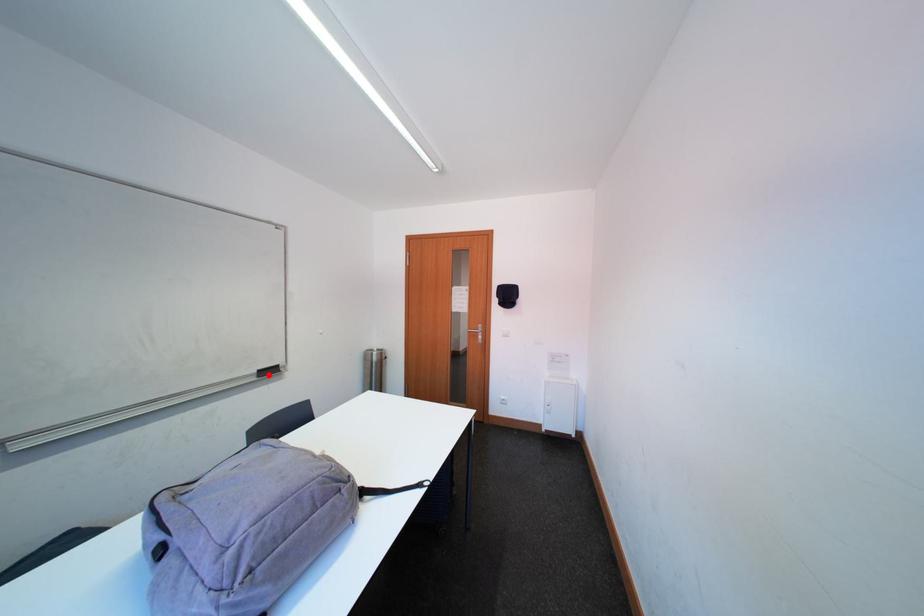
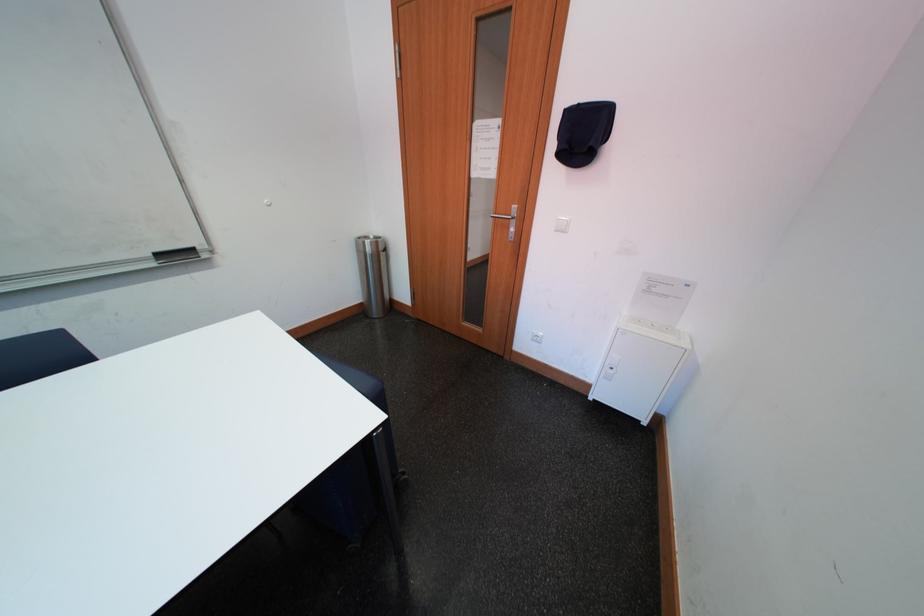
Find the pixel in the second image that matches the highlighted location in the first image.

(167, 257)